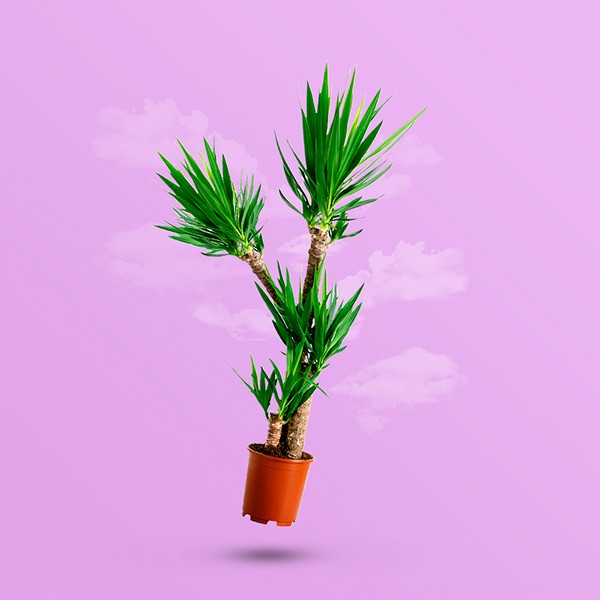
This screenshot has width=600, height=600. In order to click on plastic pot in this screenshot , I will do `click(264, 481)`.